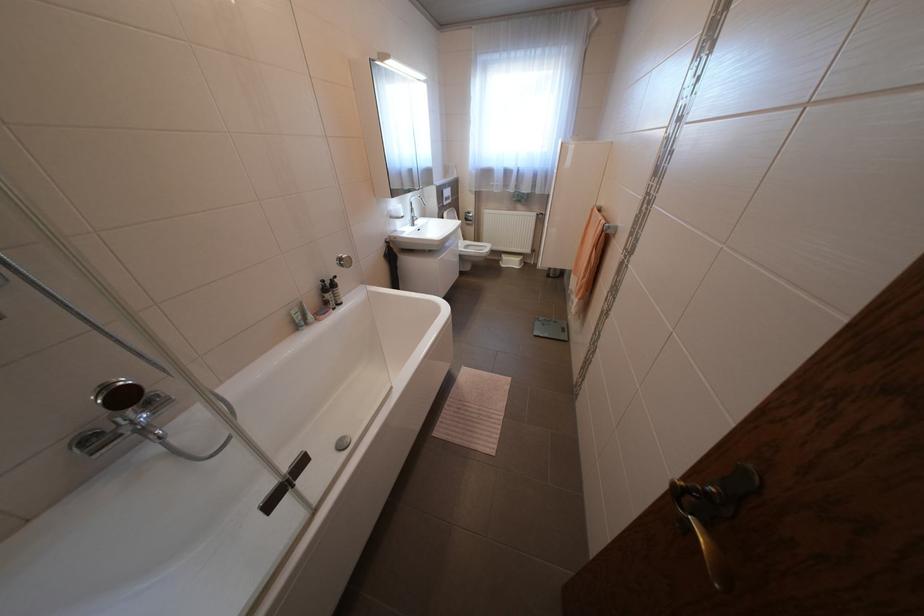
At what (x,y) coordinates should I click in order to perform the action: click on sink faucet handle. Please return your answer as a coordinate pair (x, y). The height and width of the screenshot is (616, 924). Looking at the image, I should click on (411, 211).